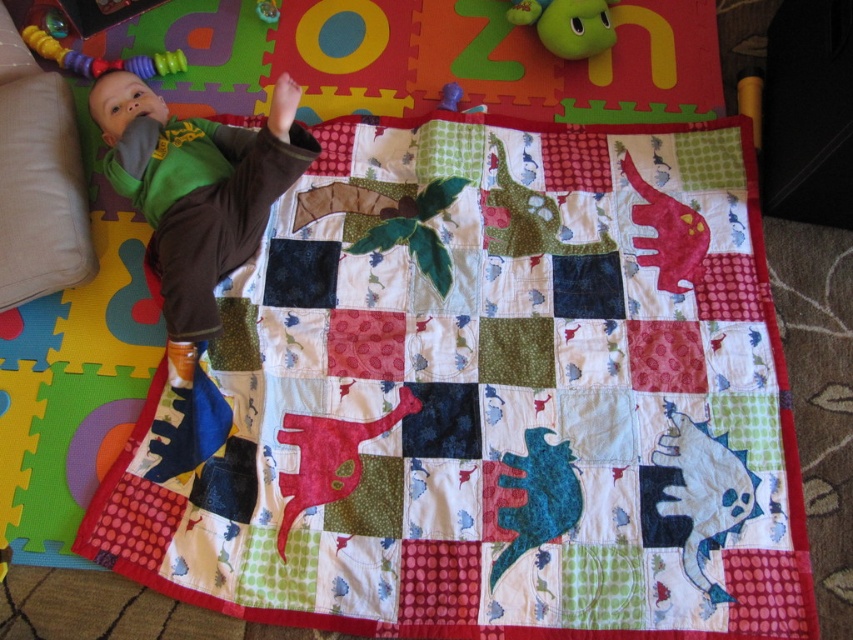
Question: Which object is the closest to the matte red dinosaur at center?

Choices:
 (A) matte green shirt at upper left
 (B) multicolored quilt with dinosaur patches at center
 (C) rubberized plastic teething ring at upper left
 (D) beige fabric pillow at left

Answer: (B)

Question: Considering the relative positions of multicolored quilt with dinosaur patches at center and rubberized plastic teething ring at upper left in the image provided, where is multicolored quilt with dinosaur patches at center located with respect to rubberized plastic teething ring at upper left?

Choices:
 (A) left
 (B) right

Answer: (B)

Question: Among these objects, which one is farthest from the camera?

Choices:
 (A) multicolored quilt with dinosaur patches at center
 (B) beige fabric pillow at left
 (C) rubberized plastic teething ring at upper left
 (D) matte green shirt at upper left

Answer: (C)

Question: Which point is farther to the camera?

Choices:
 (A) (173, 64)
 (B) (210, 157)

Answer: (A)

Question: Is multicolored quilt with dinosaur patches at center closer to camera compared to beige fabric pillow at left?

Choices:
 (A) no
 (B) yes

Answer: (B)

Question: Does multicolored quilt with dinosaur patches at center have a smaller size compared to beige fabric pillow at left?

Choices:
 (A) yes
 (B) no

Answer: (B)